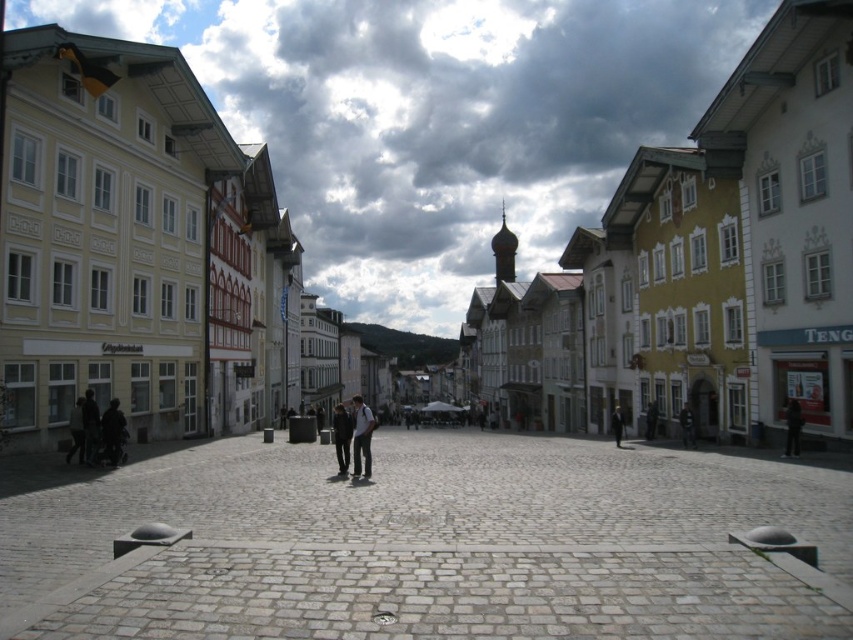
You are a tailor in the town square and need to determine which of the two dark gray garments at the center is taller. Which one is taller between the dark gray suit at center and the dark gray fabric coat at center?

The dark gray suit at center is taller than the dark gray fabric coat at center.

You are a photographer standing in the town square and want to capture both the dark gray suit at left and the dark blue suit at center in a single frame. Which suit should you position closer to the left edge of your camera viewfinder to ensure both are included?

The dark gray suit at left is positioned on the left side of the dark blue suit at center, so to include both in the frame, you should position the dark gray suit at left closer to the left edge of the camera viewfinder.

You are standing in the town square and see two dark gray jackets. The first is labeled as the dark gray jacket at left, and the second is the dark gray fabric jacket at lower left. Which jacket is nearer to you?

The dark gray jacket at left is closer to the viewer than the dark gray fabric jacket at lower left.